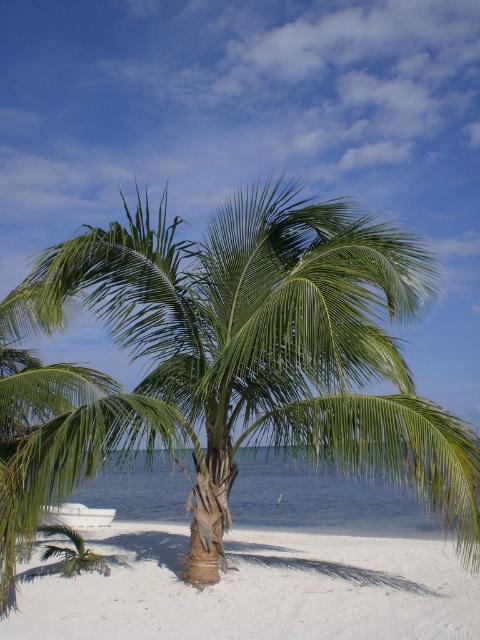
Is point (121, 307) in front of point (317, 554)?

Yes.

Is point (247, 321) positioned before point (117, 624)?

No, it is not.

The image size is (480, 640). In order to click on green leafy palm tree at center in this screenshot , I will do `click(248, 360)`.